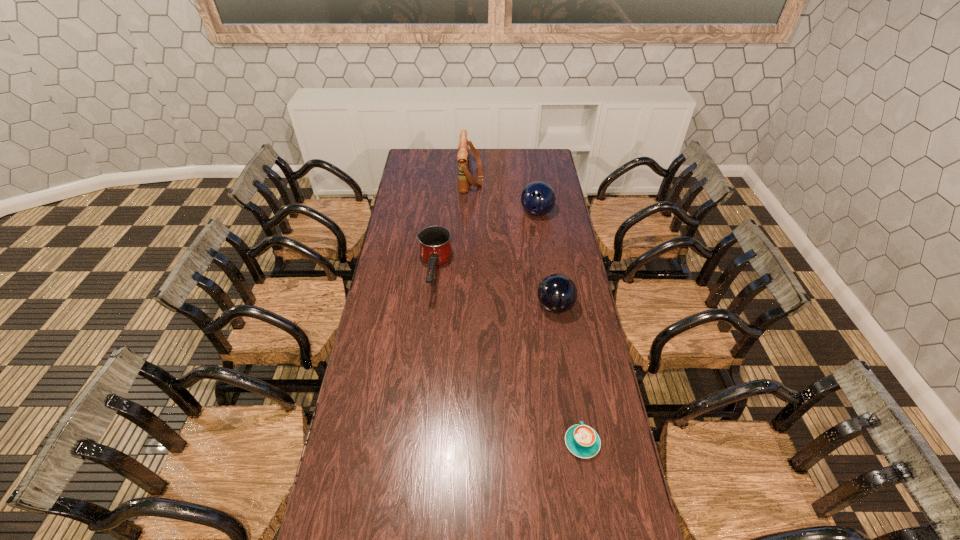
The width and height of the screenshot is (960, 540). I want to click on the farthest object, so click(x=464, y=177).

This screenshot has height=540, width=960. In order to click on the tallest object in this screenshot , I will do `click(464, 177)`.

Locate an element on the screen. The height and width of the screenshot is (540, 960). the second farthest object is located at coordinates (537, 198).

The image size is (960, 540). What are the coordinates of `the nearer bowling ball` in the screenshot? It's located at (557, 293).

You are a GUI agent. You are given a task and a screenshot of the screen. Output one action in this format:
    pyautogui.click(x=<x>, y=<y>)
    Task: Click on the leftmost object
    
    Given the screenshot: What is the action you would take?
    pyautogui.click(x=435, y=248)

This screenshot has height=540, width=960. What are the coordinates of `the nearest object` in the screenshot? It's located at (583, 441).

At what (x,y) coordinates should I click in order to perform the action: click on the shortest object. Please return your answer as a coordinate pair (x, y). The width and height of the screenshot is (960, 540). Looking at the image, I should click on (583, 441).

What are the coordinates of `vacant space situated on the front-facing side of the farthest object` in the screenshot? It's located at (542, 178).

Locate an element on the screen. The width and height of the screenshot is (960, 540). vacant space located on the surface of the fourth nearest object near the finger holes is located at coordinates (545, 273).

Locate an element on the screen. The height and width of the screenshot is (540, 960). vacant space situated 0.360m on the side of the nearer bowling ball with the finger holes is located at coordinates (449, 306).